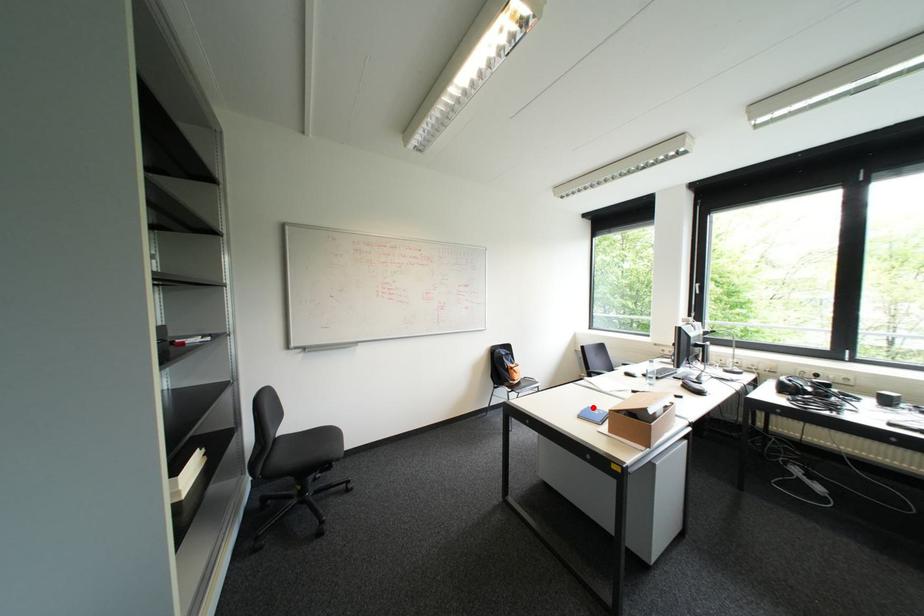
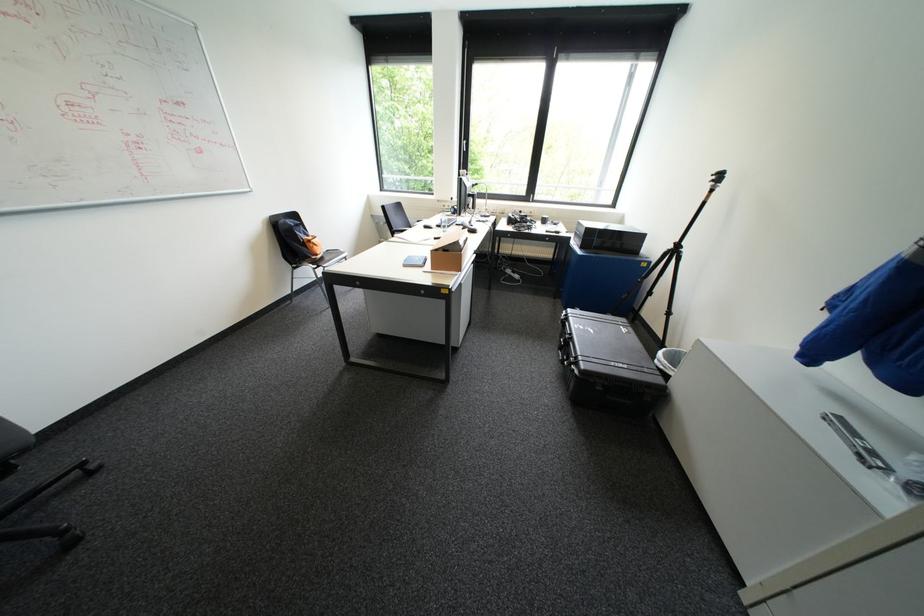
Question: I am providing you with two images of the same scene from different viewpoints. Given a red point in image1, look at the same physical point in image2. Is it:

Choices:
 (A) Closer to the viewpoint
 (B) Farther from the viewpoint

Answer: (B)